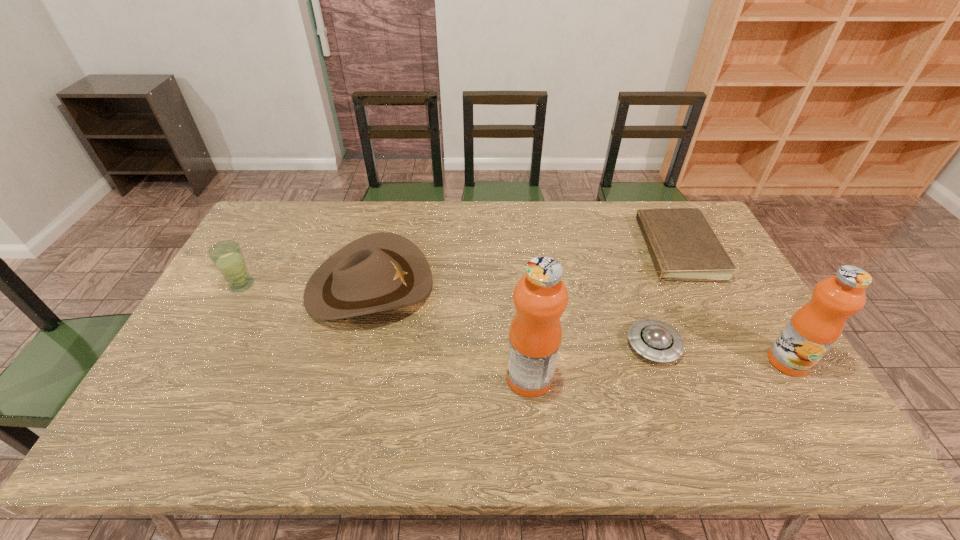
Find the location of a particular element. This screenshot has height=540, width=960. free region located 0.250m on the spine side of the paperback book is located at coordinates (549, 249).

This screenshot has height=540, width=960. In order to click on vacant space situated 0.140m on the spine side of the paperback book in this screenshot , I will do coord(582,249).

Locate an element on the screen. This screenshot has width=960, height=540. free point located 0.200m on the spine side of the paperback book is located at coordinates (564, 249).

This screenshot has width=960, height=540. I want to click on vacant space located 0.150m with a star on the front of the cowboy hat, so click(482, 286).

The height and width of the screenshot is (540, 960). Identify the location of vacant space located on the back of the leftmost object. (287, 202).

The image size is (960, 540). I want to click on vacant space located 0.300m on the back of the fifth tallest object, so click(622, 254).

Locate an element on the screen. This screenshot has height=540, width=960. object that is positioned at the far edge is located at coordinates (683, 246).

Identify the location of object at the left edge. [227, 256].

Locate an element on the screen. This screenshot has width=960, height=540. fruit juice at the right edge is located at coordinates (814, 328).

This screenshot has height=540, width=960. What are the coordinates of `paperback book positioned at the right edge` in the screenshot? It's located at (683, 246).